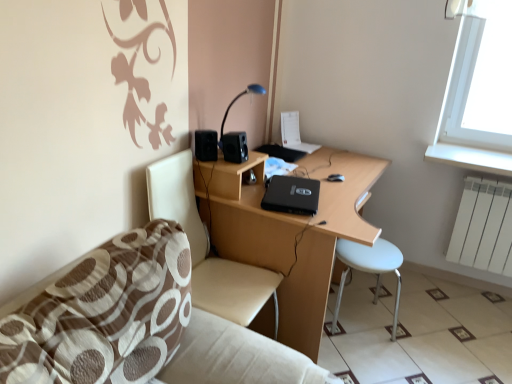
At what (x,y) coordinates should I click in order to perform the action: click on vacant space situated above white matte radiator at right (from a real-world perspective). Please return your answer as a coordinate pair (x, y). Looking at the image, I should click on 493,177.